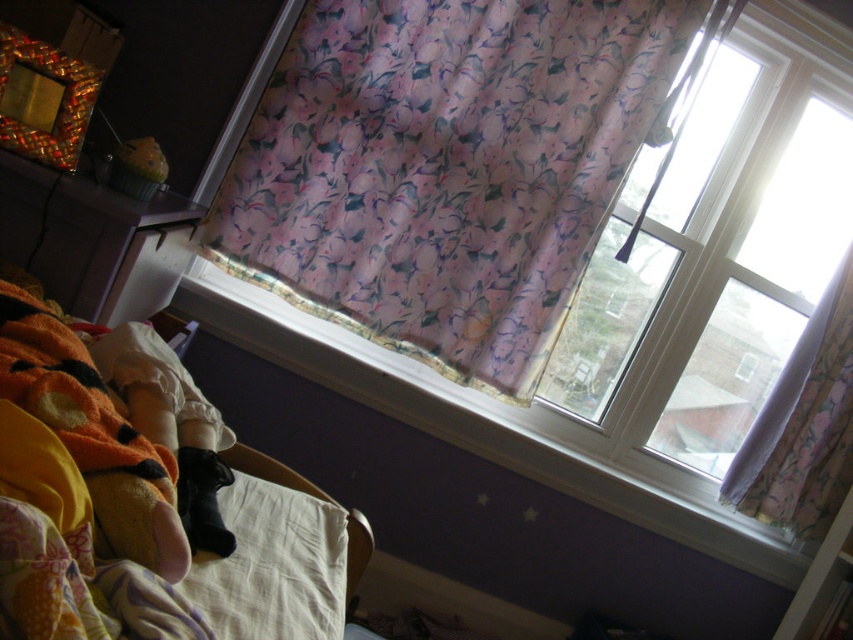
You are standing in the bedroom and want to see more of the outside view through the window. Which curtain, the floral fabric curtain at upper center or the pink floral fabric curtain at upper right, should you move to allow more visibility?

The pink floral fabric curtain at upper right is shorter than the floral fabric curtain at upper center. Moving the pink floral fabric curtain at upper right would allow more visibility since it is lower and shorter, making it easier to see through the open window pane.

You are trying to decide where to place a small nightlight in the bedroom. The nightlight is 10 cm tall. You want to place it on either the fluffy yellow fabric at lower left or the white cotton pillow at lower left. Which surface can it fit on without being hidden?

The fluffy yellow fabric at lower left is much taller than the white cotton pillow at lower left, so the nightlight will be hidden on the white cotton pillow at lower left but visible on the fluffy yellow fabric at lower left. Therefore, you should place it on the fluffy yellow fabric at lower left.

What are the coordinates of the floral fabric curtain at upper center?

The coordinates of the floral fabric curtain at upper center are at point (451,166).